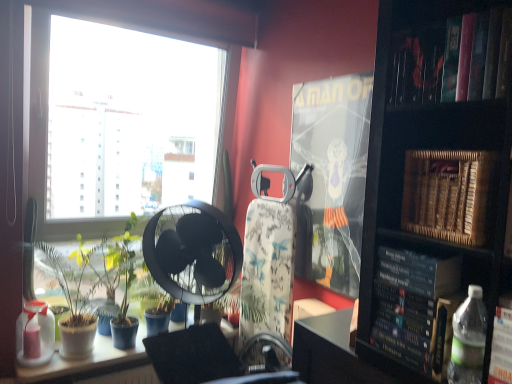
This screenshot has width=512, height=384. Describe the element at coordinates (453, 59) in the screenshot. I see `hardcover book at upper right` at that location.

You are a GUI agent. You are given a task and a screenshot of the screen. Output one action in this format:
    pyautogui.click(x=<x>, y=<y>)
    Task: Click on the hardcover book at right, which appears as the 2th paperback book when viewed from the back
    Image resolution: width=512 pixels, height=384 pixels.
    Given the screenshot: What is the action you would take?
    pyautogui.click(x=415, y=308)

The height and width of the screenshot is (384, 512). Identify the location of metallic swivel chair at center. (264, 364).

At what (x,y) coordinates should I click in order to perform the action: click on translucent plastic bottle at lower left, placed as the second bottle when sorted from top to bottom. Please return your answer as a coordinate pair (x, y). Looking at the image, I should click on (35, 334).

Where is `wooden piano at right, the third paperback book from the back`? wooden piano at right, the third paperback book from the back is located at coordinates (448, 194).

Where is `hardcover book at upper right`? Image resolution: width=512 pixels, height=384 pixels. hardcover book at upper right is located at coordinates (453, 59).

Between point (432, 257) and point (451, 358), which one is positioned behind?

The point (432, 257) is farther from the camera.

Could you tell me if hardcover book at right, which appears as the second paperback book when viewed from the front, is facing clear plastic bottle at lower right, marked as the 1th bottle in a front-to-back arrangement?

No, hardcover book at right, which appears as the second paperback book when viewed from the front, is not turned towards clear plastic bottle at lower right, marked as the 1th bottle in a front-to-back arrangement.

Who is shorter, hardcover book at right, which appears as the 2th paperback book when viewed from the back, or clear plastic bottle at lower right, which is counted as the 1th bottle, starting from the right?

clear plastic bottle at lower right, which is counted as the 1th bottle, starting from the right, is shorter.

Does hardcover book at right, which appears as the second paperback book when viewed from the front, have a larger size compared to clear plastic bottle at lower right, arranged as the 2th bottle when ordered from the bottom?

Yes, hardcover book at right, which appears as the second paperback book when viewed from the front, is bigger than clear plastic bottle at lower right, arranged as the 2th bottle when ordered from the bottom.

Which of these two, matte plastic paperback book at center, arranged as the first paperback book when viewed from the back, or hardcover book at right, which appears as the 2th paperback book when viewed from the back, is smaller?

With smaller size is hardcover book at right, which appears as the 2th paperback book when viewed from the back.

From the image's perspective, which one is positioned higher, matte plastic paperback book at center, placed as the 3th paperback book when sorted from front to back, or hardcover book at right, which appears as the second paperback book when viewed from the front?

matte plastic paperback book at center, placed as the 3th paperback book when sorted from front to back, is shown above in the image.

Is matte plastic paperback book at center, placed as the 3th paperback book when sorted from front to back, in front of or behind hardcover book at right, which appears as the second paperback book when viewed from the front, in the image?

Clearly, matte plastic paperback book at center, placed as the 3th paperback book when sorted from front to back, is behind hardcover book at right, which appears as the second paperback book when viewed from the front.

Which is in front, point (364, 178) or point (424, 306)?

The point (424, 306) is closer to the camera.

Does matte plastic paperback book at center, arranged as the first paperback book when viewed from the back, lie in front of translucent plastic bottle at lower left, placed as the first bottle when sorted from back to front?

Yes, it is.

Would you say translucent plastic bottle at lower left, the 1th bottle when ordered from bottom to top, is part of matte plastic paperback book at center, placed as the 3th paperback book when sorted from front to back,'s contents?

That's incorrect, translucent plastic bottle at lower left, the 1th bottle when ordered from bottom to top, is not inside matte plastic paperback book at center, placed as the 3th paperback book when sorted from front to back.

In the scene shown: Which object is wider, matte plastic paperback book at center, arranged as the first paperback book when viewed from the back, or translucent plastic bottle at lower left, the second bottle from the right?

translucent plastic bottle at lower left, the second bottle from the right.

Is point (352, 179) in front of point (51, 346)?

Yes, it is.

Between white glossy table at lower left and hardcover book at upper right, which one has larger size?

hardcover book at upper right.

Is white glossy table at lower left not close to hardcover book at upper right?

Absolutely, white glossy table at lower left is distant from hardcover book at upper right.

Which is in front, point (114, 359) or point (441, 23)?

The point (441, 23) is more forward.

Which is behind, clear plastic bottle at lower right, marked as the 1th bottle in a front-to-back arrangement, or hardcover book at upper right?

clear plastic bottle at lower right, marked as the 1th bottle in a front-to-back arrangement, is further from the camera.

Is clear plastic bottle at lower right, the 1th bottle in the top-to-bottom sequence, aimed at hardcover book at upper right?

No, clear plastic bottle at lower right, the 1th bottle in the top-to-bottom sequence, is not turned towards hardcover book at upper right.

From the image's perspective, would you say clear plastic bottle at lower right, arranged as the 2th bottle when ordered from the bottom, is shown under hardcover book at upper right?

Yes, from the image's perspective, clear plastic bottle at lower right, arranged as the 2th bottle when ordered from the bottom, is beneath hardcover book at upper right.

Considering the relative sizes of clear plastic bottle at lower right, which ranks as the second bottle in left-to-right order, and hardcover book at upper right in the image provided, is clear plastic bottle at lower right, which ranks as the second bottle in left-to-right order, smaller than hardcover book at upper right?

Correct, clear plastic bottle at lower right, which ranks as the second bottle in left-to-right order, occupies less space than hardcover book at upper right.

Is white glossy table at lower left beside metallic swivel chair at center?

There is a gap between white glossy table at lower left and metallic swivel chair at center.

From the image's perspective, between white glossy table at lower left and metallic swivel chair at center, who is located below?

white glossy table at lower left appears lower in the image.

How far apart are white glossy table at lower left and metallic swivel chair at center?

white glossy table at lower left is 25.96 inches from metallic swivel chair at center.

Can you confirm if white glossy table at lower left is smaller than metallic swivel chair at center?

No.

Is metallic swivel chair at center to the left of wooden piano at right, the first paperback book viewed from the front, from the viewer's perspective?

Yes.

Is metallic swivel chair at center turned away from wooden piano at right, the first paperback book viewed from the front?

No, metallic swivel chair at center is not facing away from wooden piano at right, the first paperback book viewed from the front.

Is metallic swivel chair at center not inside wooden piano at right, the third paperback book from the back?

Indeed, metallic swivel chair at center is completely outside wooden piano at right, the third paperback book from the back.

Consider the image. From the image's perspective, is metallic swivel chair at center above or below wooden piano at right, the third paperback book from the back?

Based on their image positions, metallic swivel chair at center is located beneath wooden piano at right, the third paperback book from the back.

Find the location of a particular element. bottle on the right of hardcover book at right, which appears as the 2th paperback book when viewed from the back is located at coordinates (468, 339).

This screenshot has width=512, height=384. What are the coordinates of `paperback book behind the hardcover book at right, which appears as the 2th paperback book when viewed from the back` in the screenshot? It's located at (334, 171).

From the image, which object appears to be farther from clear plastic bottle at lower right, which ranks as the second bottle in left-to-right order, matte plastic paperback book at center, placed as the 3th paperback book when sorted from front to back, or metallic swivel chair at center?

metallic swivel chair at center.

In the scene shown: From the image, which object appears to be nearer to translucent plastic bottle at lower left, placed as the second bottle when sorted from top to bottom, green leafy plant at window, the 1th plant when ordered from right to left, or wooden piano at right, the third paperback book from the back?

The object closer to translucent plastic bottle at lower left, placed as the second bottle when sorted from top to bottom, is green leafy plant at window, the 1th plant when ordered from right to left.

From the image, which object appears to be farther from wooden piano at right, the first paperback book viewed from the front, green leafy plant at window, the 1th plant when ordered from right to left, or hardcover book at upper right?

Among the two, green leafy plant at window, the 1th plant when ordered from right to left, is located further to wooden piano at right, the first paperback book viewed from the front.

Considering their positions, is wooden piano at right, the first paperback book viewed from the front, positioned closer to clear plastic bottle at lower right, which ranks as the second bottle in left-to-right order, than white glossy table at lower left?

Among the two, wooden piano at right, the first paperback book viewed from the front, is located nearer to clear plastic bottle at lower right, which ranks as the second bottle in left-to-right order.

Looking at the image, which one is located further to wooden piano at right, the third paperback book from the back, hardcover book at upper right or clear plastic bottle at lower right, arranged as the 2th bottle when ordered from the bottom?

The object further to wooden piano at right, the third paperback book from the back, is clear plastic bottle at lower right, arranged as the 2th bottle when ordered from the bottom.

Based on the photo, when comparing their distances from matte plastic paperback book at center, placed as the 3th paperback book when sorted from front to back, does clear plastic bottle at lower right, the 1th bottle in the top-to-bottom sequence, or wooden piano at right, the third paperback book from the back, seem closer?

The object closer to matte plastic paperback book at center, placed as the 3th paperback book when sorted from front to back, is wooden piano at right, the third paperback book from the back.

From the image, which object appears to be nearer to hardcover book at upper right, green leafy plant at window, the 1th plant when ordered from right to left, or clear plastic bottle at lower right, which ranks as the second bottle in left-to-right order?

The object closer to hardcover book at upper right is clear plastic bottle at lower right, which ranks as the second bottle in left-to-right order.

Based on their spatial positions, is matte plastic paperback book at center, placed as the 3th paperback book when sorted from front to back, or hardcover book at upper right closer to hardcover book at right, which appears as the 2th paperback book when viewed from the back?

hardcover book at upper right is positioned closer to the anchor hardcover book at right, which appears as the 2th paperback book when viewed from the back.

Locate an element on the screen. The image size is (512, 384). bottle between green leafy plant at window, the 2th plant when ordered from left to right, and hardcover book at upper right, in the horizontal direction is located at coordinates (468, 339).

Where is `table between translucent plastic bottle at lower left, the 1th bottle when ordered from bottom to top, and wooden piano at right, the first paperback book viewed from the front, from left to right`? table between translucent plastic bottle at lower left, the 1th bottle when ordered from bottom to top, and wooden piano at right, the first paperback book viewed from the front, from left to right is located at coordinates (96, 366).

This screenshot has height=384, width=512. In order to click on table between green matte plant at lower left, positioned as the second plant in right-to-left order, and wooden piano at right, the first paperback book viewed from the front, in the horizontal direction in this screenshot , I will do `click(96, 366)`.

Locate an element on the screen. Image resolution: width=512 pixels, height=384 pixels. table situated between translucent plastic bottle at lower left, placed as the first bottle when sorted from back to front, and matte plastic paperback book at center, arranged as the first paperback book when viewed from the back, from left to right is located at coordinates (96, 366).